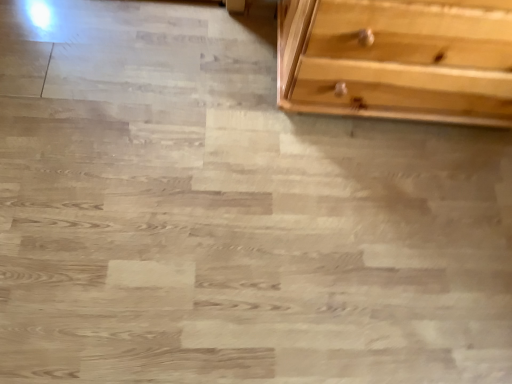
In order to face light wood chest of drawers at upper right, should I rotate leftwards or rightwards?

Rotate your view right by about 23.098°.

At what (x,y) coordinates should I click in order to perform the action: click on light wood chest of drawers at upper right. Please return your answer as a coordinate pair (x, y). The image size is (512, 384). Looking at the image, I should click on (397, 59).

What do you see at coordinates (397, 59) in the screenshot? The image size is (512, 384). I see `light wood chest of drawers at upper right` at bounding box center [397, 59].

Where is `light wood chest of drawers at upper right`? This screenshot has width=512, height=384. light wood chest of drawers at upper right is located at coordinates (397, 59).